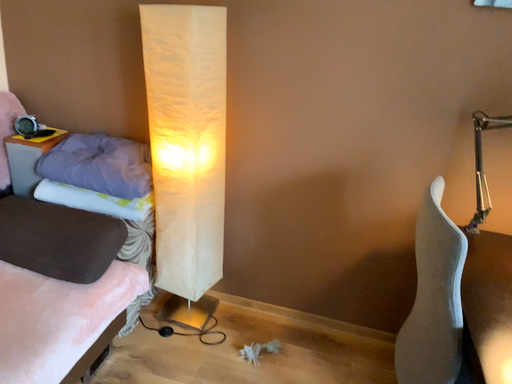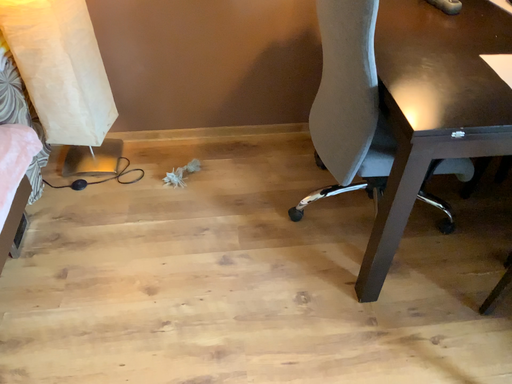
Question: How did the camera likely rotate when shooting the video?

Choices:
 (A) rotated right
 (B) rotated left

Answer: (A)